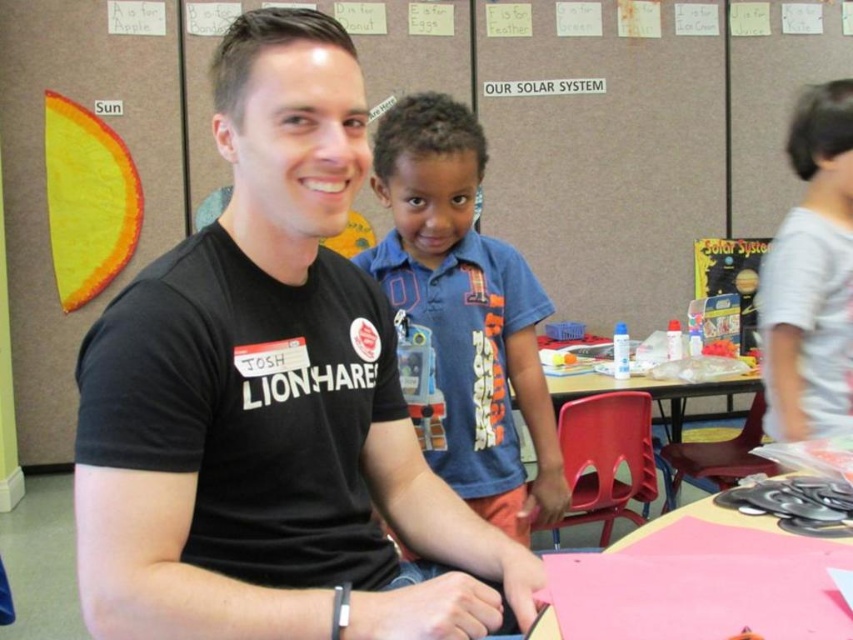
Question: Which object appears closest to the camera in this image?

Choices:
 (A) pink paper at lower right
 (B) plastic table at center
 (C) black matte t-shirt at center

Answer: (C)

Question: Which of the following is the farthest from the observer?

Choices:
 (A) (724, 394)
 (B) (363, 362)
 (C) (706, 509)
 (D) (492, 339)

Answer: (A)

Question: Which object is the closest to the blue cotton shirt at center?

Choices:
 (A) black matte t-shirt at center
 (B) white cotton shirt at right
 (C) pink paper at lower right
 (D) matte paper solar system chart at upper center

Answer: (C)

Question: Can you confirm if white cotton shirt at right is smaller than pink paper at lower right?

Choices:
 (A) yes
 (B) no

Answer: (B)

Question: Can you confirm if matte paper solar system chart at upper center is wider than white cotton shirt at right?

Choices:
 (A) yes
 (B) no

Answer: (A)

Question: Is black matte t-shirt at center closer to the viewer compared to pink paper at lower right?

Choices:
 (A) yes
 (B) no

Answer: (A)